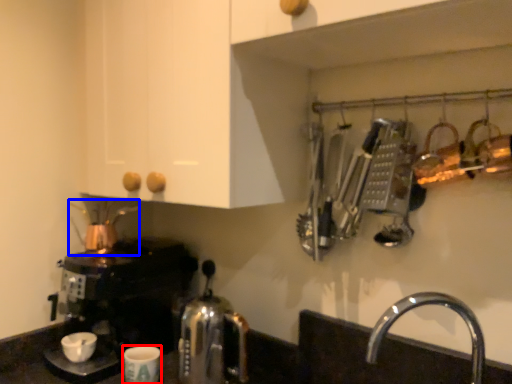
Question: Which object is further to the camera taking this photo, coffee cup (highlighted by a red box) or tea pot (highlighted by a blue box)?

Choices:
 (A) coffee cup
 (B) tea pot

Answer: (B)